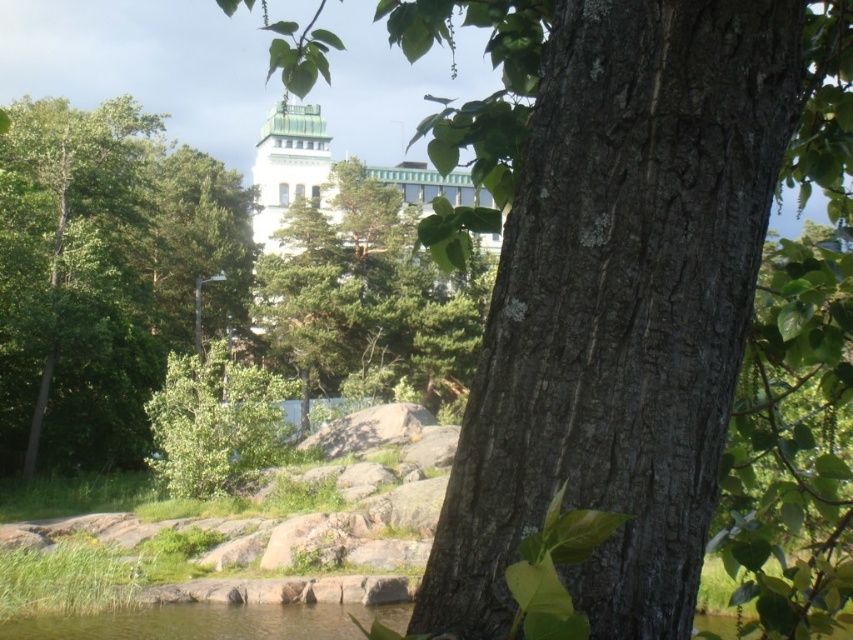
You are a hiker trying to navigate through the rocky area. You notice the smooth bark tree trunk at center and the green leafy tree at lower left. Which tree is located higher up in the scene?

The smooth bark tree trunk at center is positioned over the green leafy tree at lower left, so it is higher up in the scene.

You are a hiker who wants to climb the tallest tree in the area. Based on the scene, which tree should you choose between the smooth bark tree trunk at center and the green leafy tree at lower left?

The green leafy tree at lower left is taller than the smooth bark tree trunk at center, so you should choose the green leafy tree at lower left for climbing.

In the serene natural scene described, there is a smooth bark tree trunk at center and a green leafy tree at lower left. Which of these two trees is positioned to the right of the other?

The smooth bark tree trunk at center is positioned to the right of the green leafy tree at lower left.